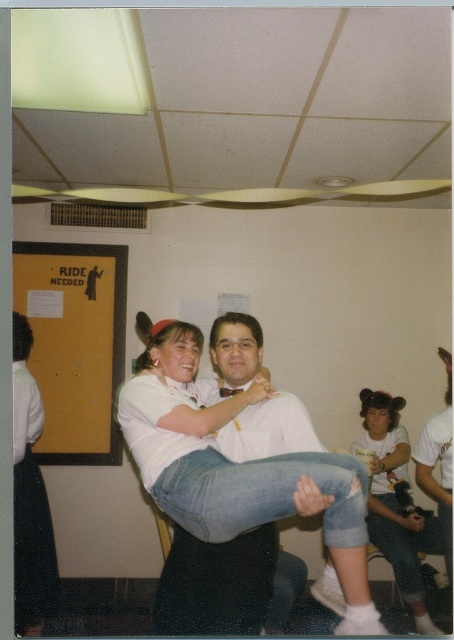
You are standing in the room and looking at the white matte shirt at upper right and the matte black arm at lower center. Which object is positioned higher in the image?

The white matte shirt at upper right is positioned higher in the image because it is much taller than the matte black arm at lower center.

You are an artist trying to draw the scene. When drawing the arms, which arm should you make wider? The white matte arm at center or the matte black arm at lower center?

The white matte arm at center should be drawn wider because its width is larger than the matte black arm at lower center.